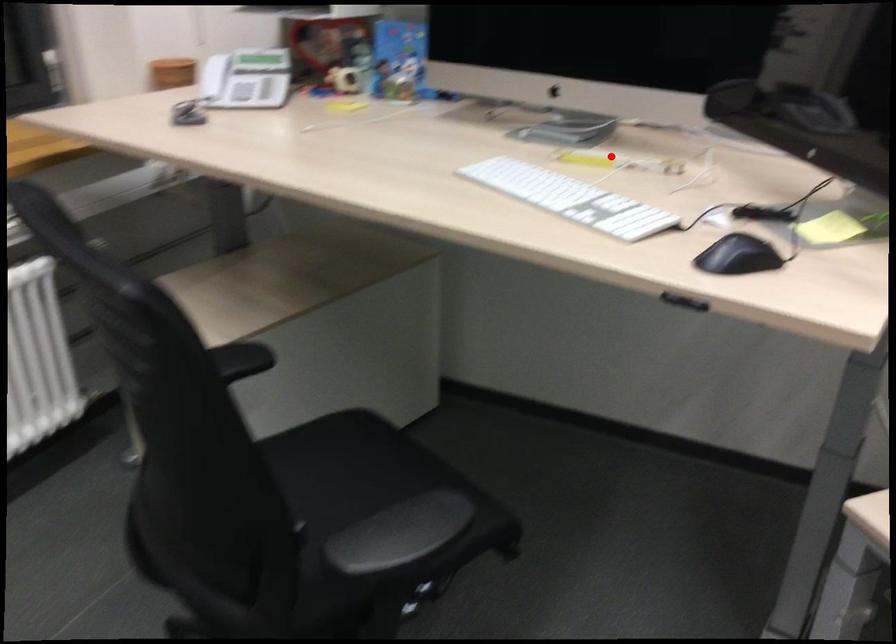
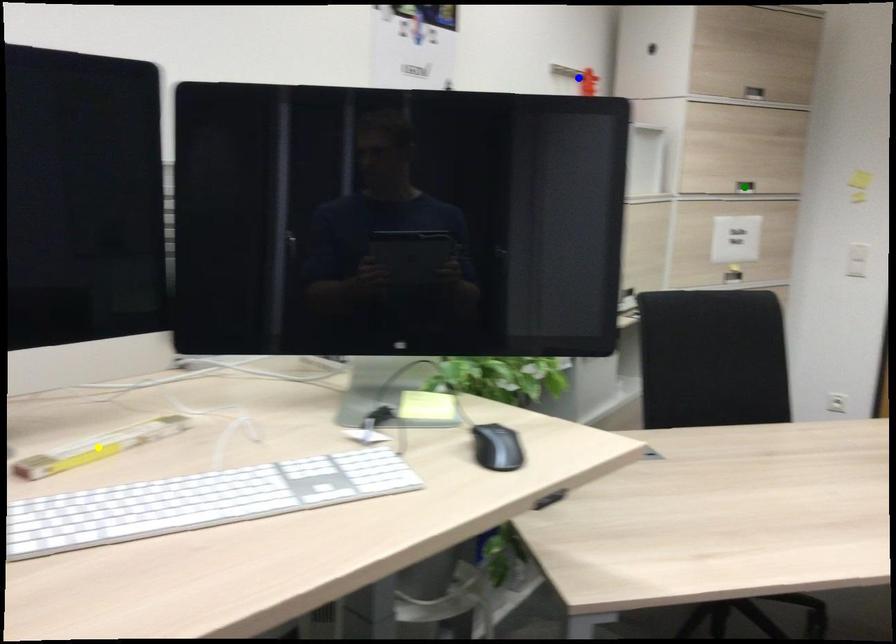
Question: I am providing you with two images of the same scene from different viewpoints. A red point is marked on the first image. You are given multiple points on the second image. Which point in image 2 represents the same 3d spot as the red point in image 1?

Choices:
 (A) yellow point
 (B) blue point
 (C) green point

Answer: (A)